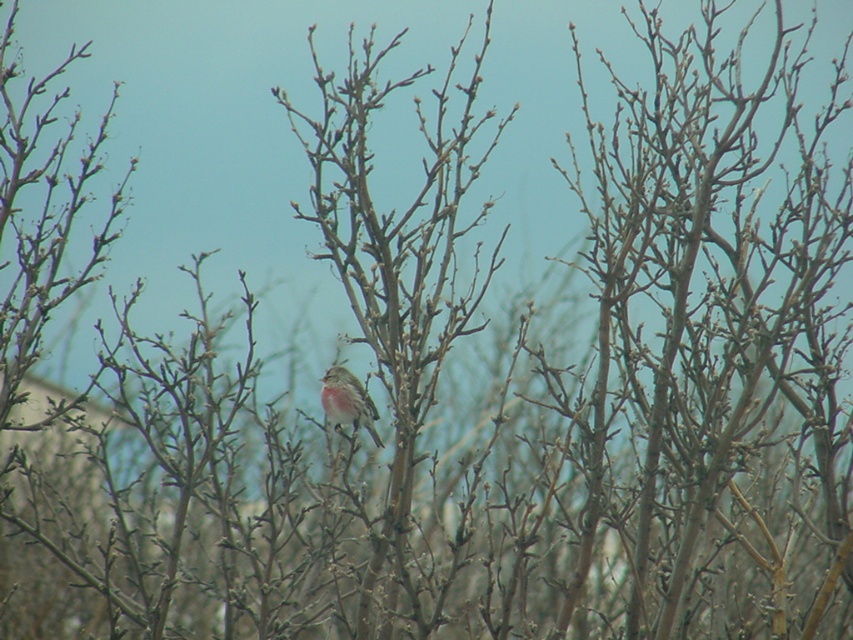
You are standing in the outdoor scene depicted. There is a point marked at coordinates (397, 260). What object is located at that point?

The point at coordinates (397, 260) marks smooth brown branches at center.

You are standing in the outdoor scene and want to touch the smooth brown branches at center and the brown speckled sparrow at center. Which one can you reach first without moving your position?

The smooth brown branches at center is closer to the viewer than the brown speckled sparrow at center, so you can reach the smooth brown branches at center first without moving your position.